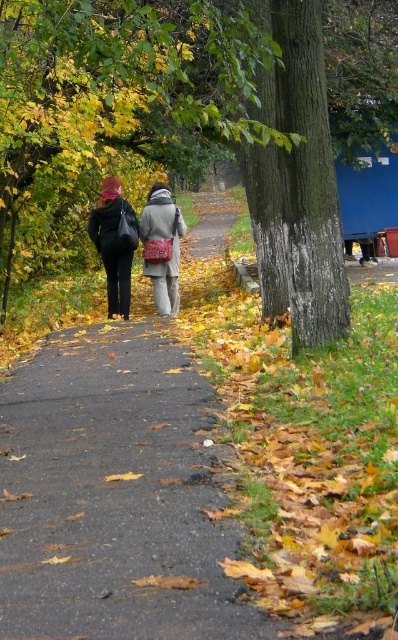
Question: Can you confirm if matte black coat at center is positioned below matte gray coat at center?

Choices:
 (A) no
 (B) yes

Answer: (A)

Question: Does matte black coat at center appear on the right side of matte gray coat at center?

Choices:
 (A) no
 (B) yes

Answer: (A)

Question: Among these points, which one is farthest from the camera?

Choices:
 (A) (152, 262)
 (B) (122, 312)

Answer: (B)

Question: Which of the following is the closest to the observer?

Choices:
 (A) matte black coat at center
 (B) matte gray coat at center

Answer: (A)

Question: Can you confirm if matte black coat at center is positioned to the left of matte gray coat at center?

Choices:
 (A) yes
 (B) no

Answer: (A)